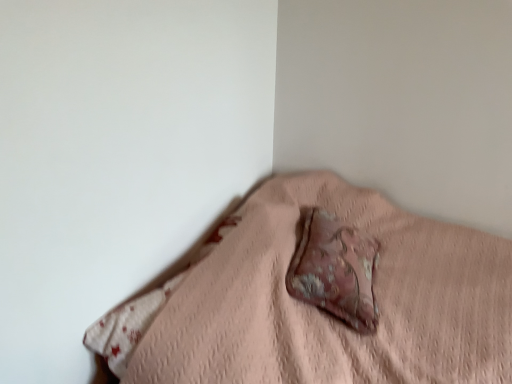
Question: Is pink fabric pillow at center taller or shorter than distressed pink fabric pillow at center?

Choices:
 (A) tall
 (B) short

Answer: (A)

Question: Considering the positions of pink fabric pillow at center and distressed pink fabric pillow at center in the image, is pink fabric pillow at center bigger or smaller than distressed pink fabric pillow at center?

Choices:
 (A) small
 (B) big

Answer: (B)

Question: Does point (327, 319) appear closer or farther from the camera than point (328, 253)?

Choices:
 (A) farther
 (B) closer

Answer: (B)

Question: In terms of size, does distressed pink fabric pillow at center appear bigger or smaller than pink fabric pillow at center?

Choices:
 (A) small
 (B) big

Answer: (A)

Question: Considering their positions, is distressed pink fabric pillow at center located in front of or behind pink fabric pillow at center?

Choices:
 (A) front
 (B) behind

Answer: (B)

Question: Is distressed pink fabric pillow at center wider or thinner than pink fabric pillow at center?

Choices:
 (A) wide
 (B) thin

Answer: (B)

Question: From their relative heights in the image, would you say distressed pink fabric pillow at center is taller or shorter than pink fabric pillow at center?

Choices:
 (A) short
 (B) tall

Answer: (A)